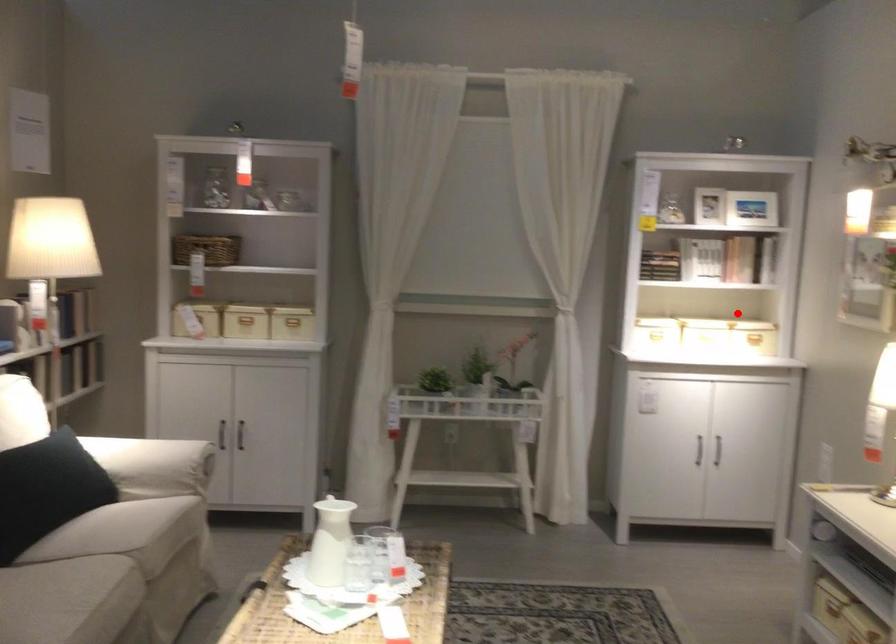
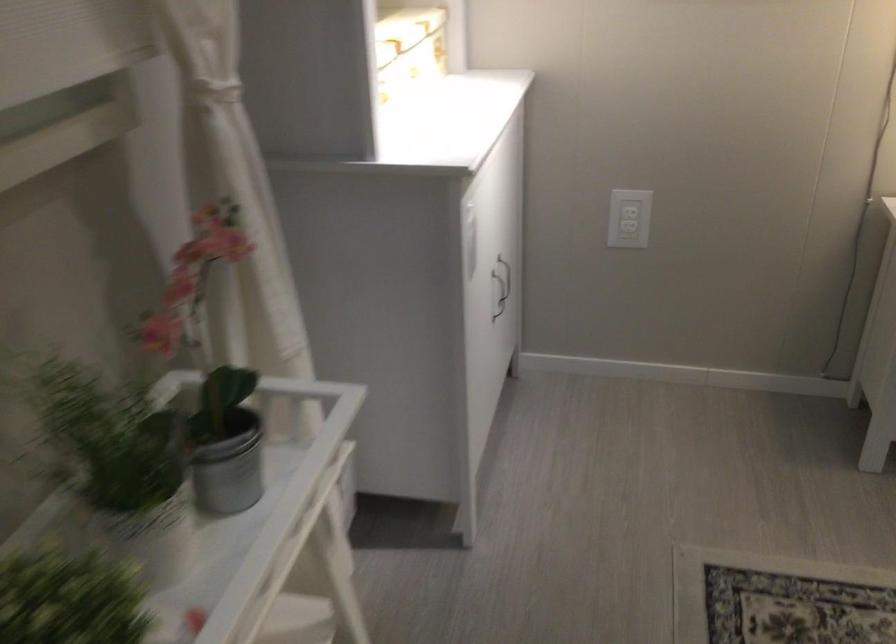
Question: I am providing you with two images of the same scene from different viewpoints. Image1 has a red point marked. In image2, the corresponding 3D location appears at what relative position? Reply with the corresponding letter.

Choices:
 (A) Closer
 (B) Farther

Answer: (A)